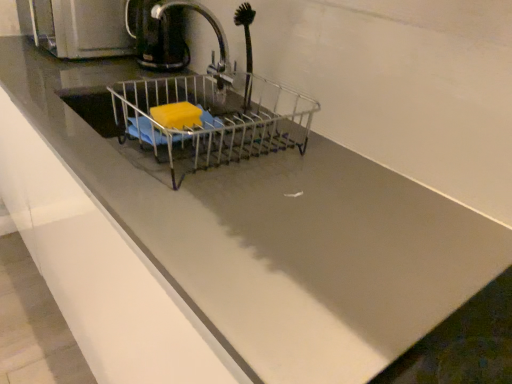
Question: Considering the relative sizes of metallic wire basket at center and black rubber brush at upper center in the image provided, is metallic wire basket at center shorter than black rubber brush at upper center?

Choices:
 (A) no
 (B) yes

Answer: (B)

Question: From a real-world perspective, is metallic wire basket at center over black rubber brush at upper center?

Choices:
 (A) yes
 (B) no

Answer: (B)

Question: Considering the relative sizes of metallic wire basket at center and black rubber brush at upper center in the image provided, is metallic wire basket at center bigger than black rubber brush at upper center?

Choices:
 (A) no
 (B) yes

Answer: (B)

Question: Is metallic wire basket at center far away from black rubber brush at upper center?

Choices:
 (A) no
 (B) yes

Answer: (A)

Question: Can you confirm if metallic wire basket at center is positioned to the right of black rubber brush at upper center?

Choices:
 (A) yes
 (B) no

Answer: (B)

Question: Do you think metallic faucet at center is within metallic wire basket at center, or outside of it?

Choices:
 (A) outside
 (B) inside

Answer: (A)

Question: Considering the positions of metallic faucet at center and metallic wire basket at center in the image, is metallic faucet at center taller or shorter than metallic wire basket at center?

Choices:
 (A) tall
 (B) short

Answer: (A)

Question: Is metallic faucet at center in front of or behind metallic wire basket at center in the image?

Choices:
 (A) behind
 (B) front

Answer: (A)

Question: In terms of width, does metallic faucet at center look wider or thinner when compared to metallic wire basket at center?

Choices:
 (A) thin
 (B) wide

Answer: (A)

Question: Is black rubber brush at upper center wider or thinner than metallic silver kettle at upper left?

Choices:
 (A) wide
 (B) thin

Answer: (B)

Question: Which is correct: black rubber brush at upper center is inside metallic silver kettle at upper left, or outside of it?

Choices:
 (A) outside
 (B) inside

Answer: (A)

Question: From their relative heights in the image, would you say black rubber brush at upper center is taller or shorter than metallic silver kettle at upper left?

Choices:
 (A) tall
 (B) short

Answer: (A)

Question: Is point (246, 64) closer or farther from the camera than point (130, 36)?

Choices:
 (A) farther
 (B) closer

Answer: (B)

Question: Do you think black plastic coffee pot at upper left is within metallic silver kettle at upper left, or outside of it?

Choices:
 (A) outside
 (B) inside

Answer: (A)

Question: From the image's perspective, relative to metallic silver kettle at upper left, is black plastic coffee pot at upper left above or below?

Choices:
 (A) above
 (B) below

Answer: (B)